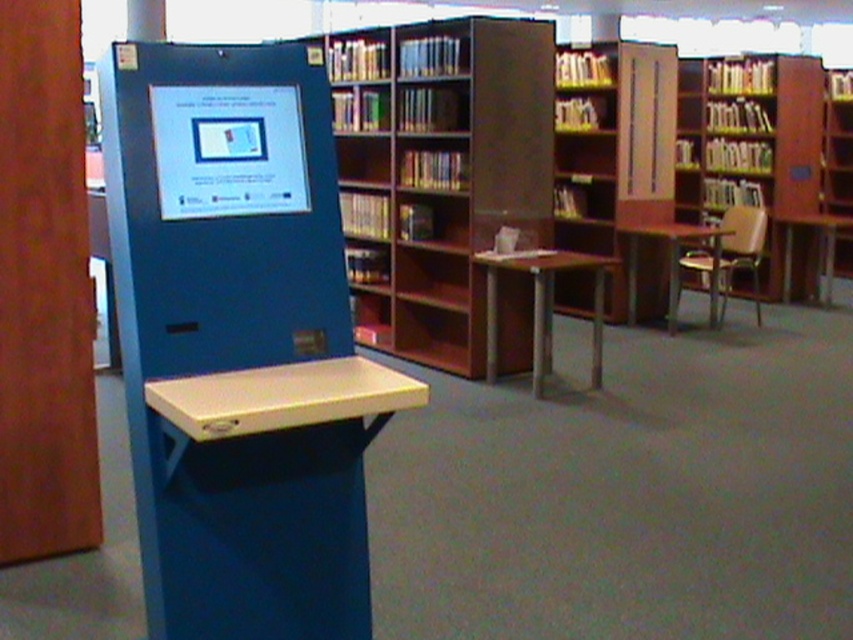
Is wooden bookcase at right positioned in front of matte plastic screen at center?

No, wooden bookcase at right is behind matte plastic screen at center.

Image resolution: width=853 pixels, height=640 pixels. What do you see at coordinates (750, 141) in the screenshot? I see `wooden bookcase at right` at bounding box center [750, 141].

You are a GUI agent. You are given a task and a screenshot of the screen. Output one action in this format:
    pyautogui.click(x=<x>, y=<y>)
    Task: Click on the wooden bookcase at right
    The width and height of the screenshot is (853, 640).
    Given the screenshot: What is the action you would take?
    pyautogui.click(x=750, y=141)

Consider the image. Can you confirm if brown wood bookcase at center is positioned to the right of matte plastic screen at center?

Yes, brown wood bookcase at center is to the right of matte plastic screen at center.

This screenshot has width=853, height=640. What do you see at coordinates (438, 172) in the screenshot? I see `brown wood bookcase at center` at bounding box center [438, 172].

Identify the location of brown wood bookcase at center. (438, 172).

Between brown wooden bookshelf at center and wooden bookcase at right, which one is positioned lower?

brown wooden bookshelf at center is below.

Measure the distance between point (x=579, y=196) and camera.

They are 23.56 feet apart.

At what (x,y) coordinates should I click in order to perform the action: click on brown wooden bookshelf at center. Please return your answer as a coordinate pair (x, y). The height and width of the screenshot is (640, 853). Looking at the image, I should click on pyautogui.click(x=613, y=148).